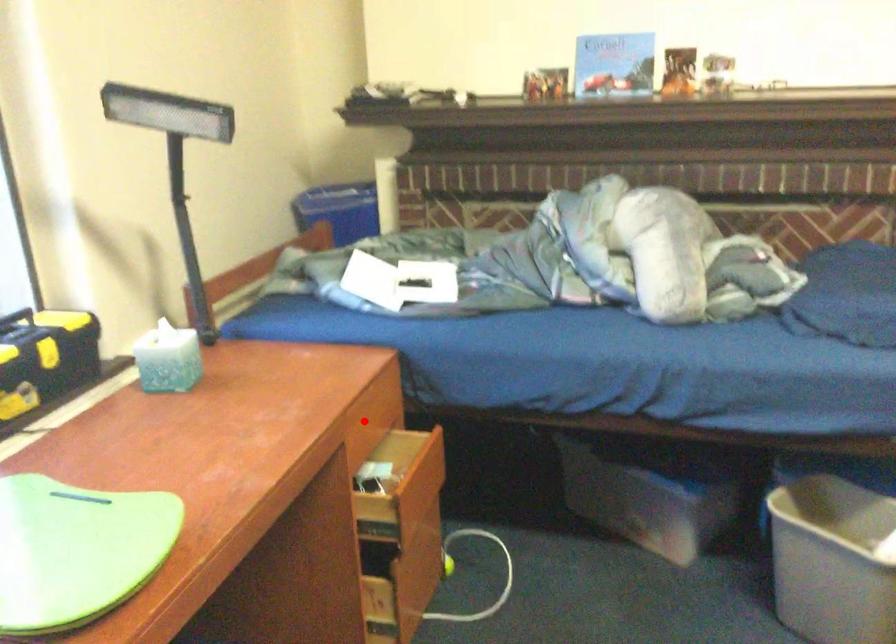
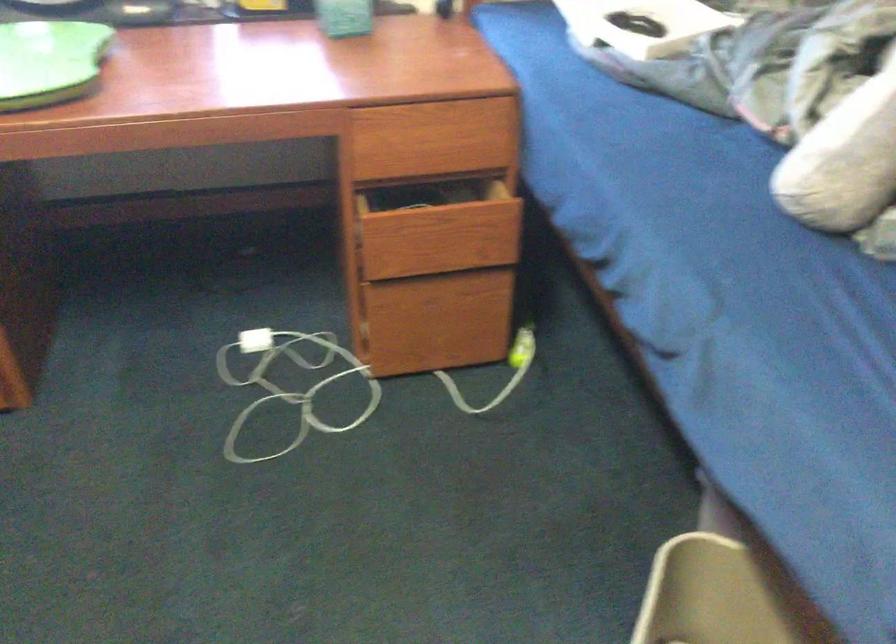
Locate, in the second image, the point that corresponds to the highlighted location in the first image.

(435, 136)